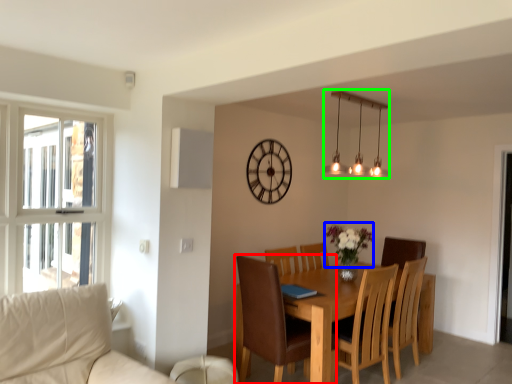
Question: Which object is the closest to the chair (highlighted by a red box)? Choose among these: flower (highlighted by a blue box) or lamp (highlighted by a green box).

Choices:
 (A) flower
 (B) lamp

Answer: (A)